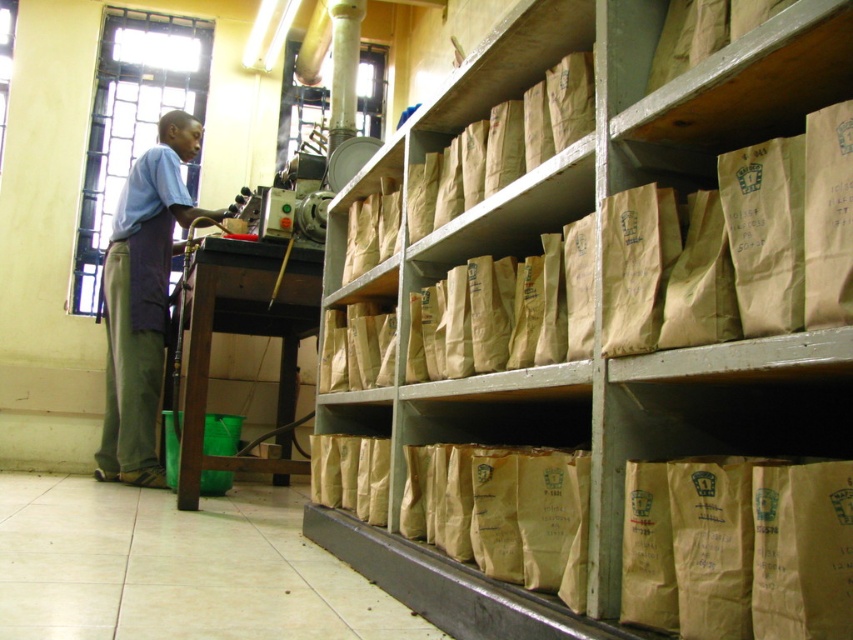
You are an inspector checking the storage area. You notice the brown paper bags at right and the blue fabric apron at left. Which object takes up more space in the storage area?

The brown paper bags at right takes up more space in the storage area than the blue fabric apron at left because it is bigger.